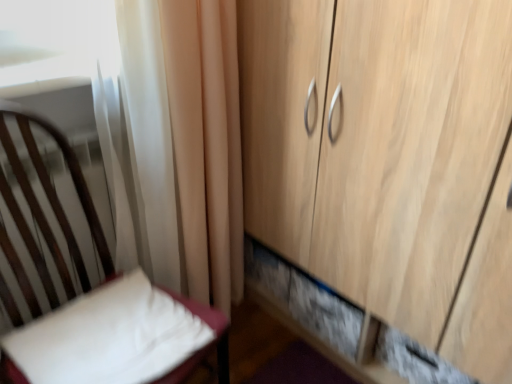
Question: Should I look upward or downward to see wooden cupboard at right?

Choices:
 (A) down
 (B) up

Answer: (A)

Question: Is white fabric chair at left looking in the opposite direction of wooden cupboard at right?

Choices:
 (A) yes
 (B) no

Answer: (B)

Question: From the image's perspective, would you say white fabric chair at left is shown under wooden cupboard at right?

Choices:
 (A) yes
 (B) no

Answer: (A)

Question: From a real-world perspective, is white fabric chair at left located higher than wooden cupboard at right?

Choices:
 (A) no
 (B) yes

Answer: (A)

Question: Does white fabric chair at left have a larger size compared to wooden cupboard at right?

Choices:
 (A) no
 (B) yes

Answer: (A)

Question: Is white fabric chair at left far from wooden cupboard at right?

Choices:
 (A) yes
 (B) no

Answer: (B)

Question: Considering the relative sizes of white fabric chair at left and wooden cupboard at right in the image provided, is white fabric chair at left taller than wooden cupboard at right?

Choices:
 (A) yes
 (B) no

Answer: (B)

Question: Can you confirm if white soft pillow at lower left is shorter than white fabric chair at left?

Choices:
 (A) yes
 (B) no

Answer: (A)

Question: From a real-world perspective, does white soft pillow at lower left sit lower than white fabric chair at left?

Choices:
 (A) no
 (B) yes

Answer: (B)

Question: Is white fabric chair at left inside white soft pillow at lower left?

Choices:
 (A) no
 (B) yes

Answer: (A)

Question: Is white soft pillow at lower left thinner than white fabric chair at left?

Choices:
 (A) yes
 (B) no

Answer: (A)

Question: From a real-world perspective, is white soft pillow at lower left on white fabric chair at left?

Choices:
 (A) yes
 (B) no

Answer: (B)

Question: Would you say white soft pillow at lower left is a long distance from white fabric chair at left?

Choices:
 (A) no
 (B) yes

Answer: (A)

Question: Considering the relative sizes of white soft pillow at lower left and wooden cupboard at right in the image provided, is white soft pillow at lower left taller than wooden cupboard at right?

Choices:
 (A) no
 (B) yes

Answer: (A)